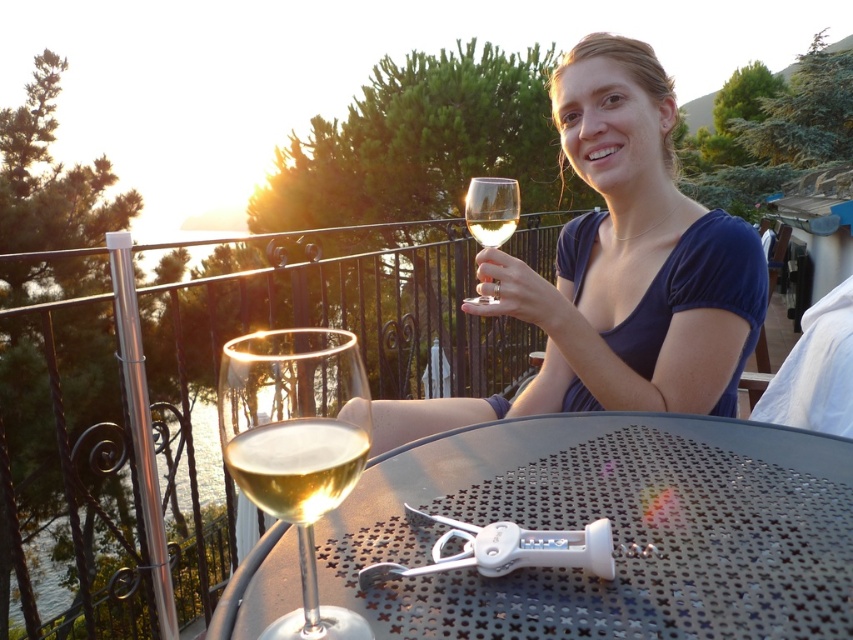
You are a photographer setting up for a closeup shot of the metallic gray table at center and the clear glass wine glass at upper center. The camera can only focus on objects within 15 inches of each other. Will both items be in focus?

The metallic gray table at center is 16.12 inches from the clear glass wine glass at upper center, which exceeds the camera focus range of 15 inches. Therefore, both items cannot be in focus simultaneously.

You are a bartender who needs to place a 12 inch long bottle between the matte glass wine glass at center and the clear glass wine glass at center. Is there enough space between them to fit the bottle?

The distance between the matte glass wine glass at center and the clear glass wine glass at center is 21.85 inches. Since the bottle is 12 inches long, there is enough space between them to fit the bottle.